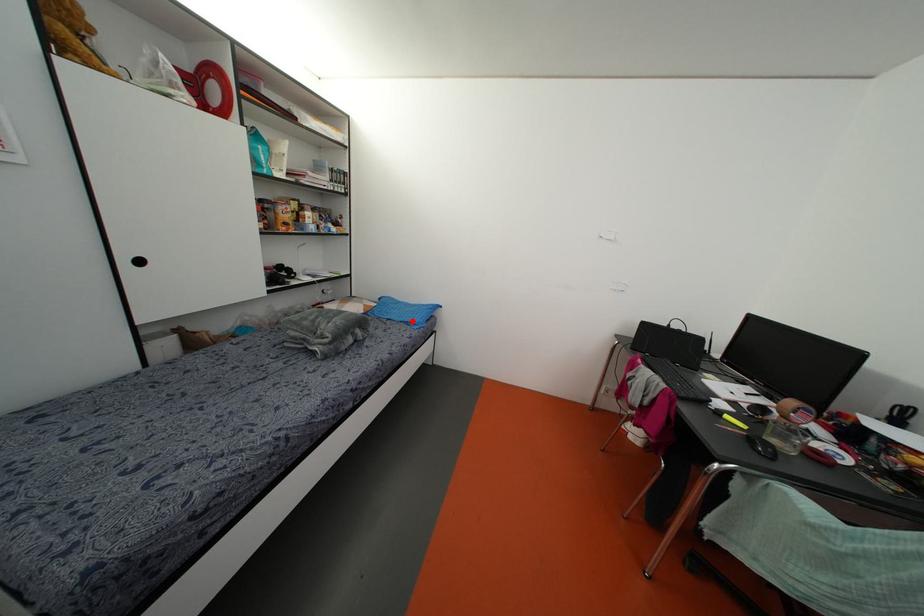
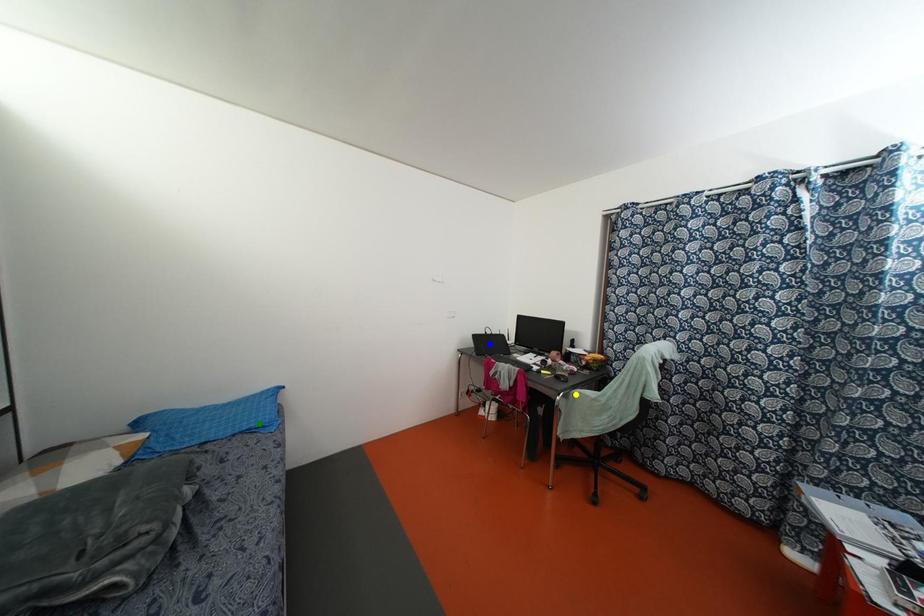
Question: I am providing you with two images of the same scene from different viewpoints. A red point is marked on the first image. You are given multiple points on the second image. Which point in image 2 is actually the same real-world point as the red point in image 1?

Choices:
 (A) blue point
 (B) yellow point
 (C) green point

Answer: (C)